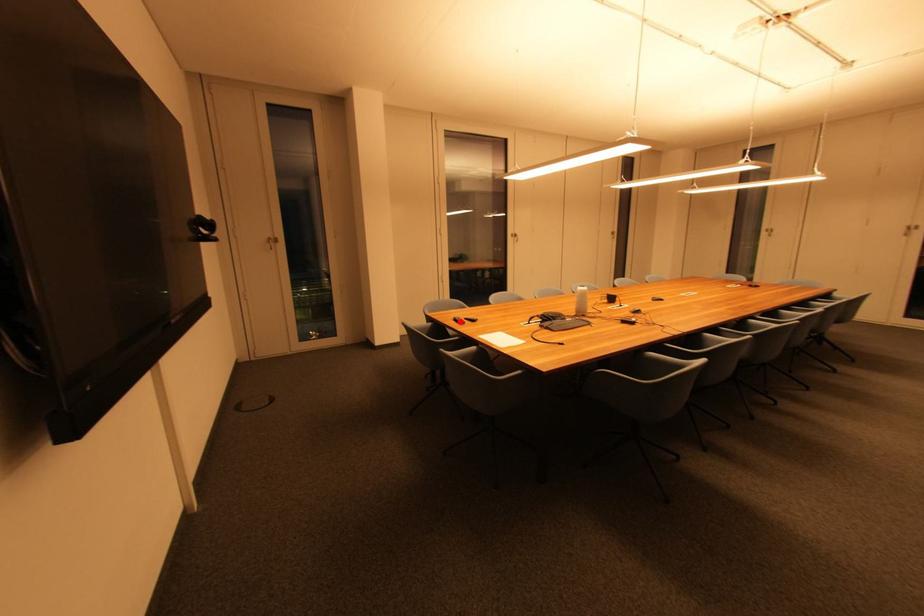
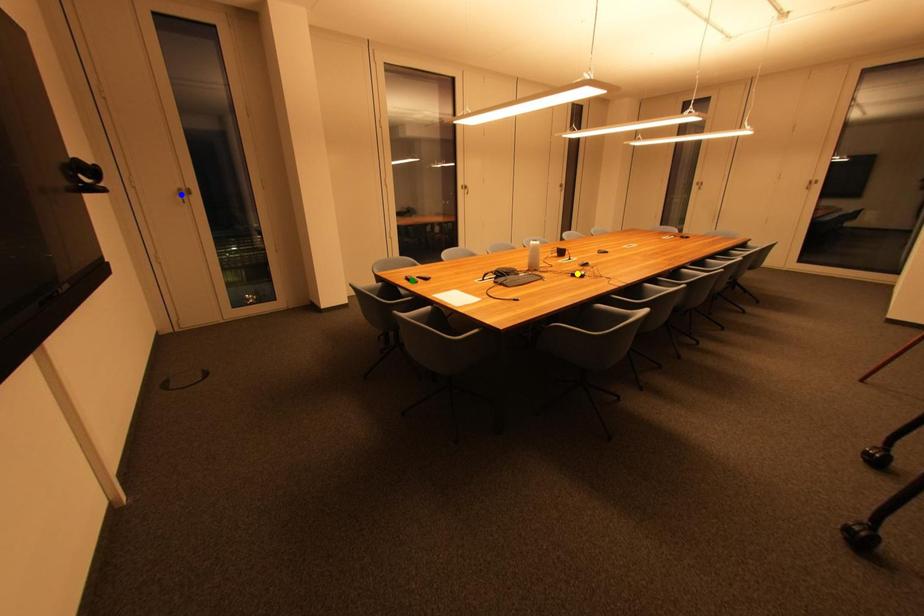
Question: I am providing you with two images of the same scene from different viewpoints. A red point is marked on the first image. You are given multiple points on the second image. In image 2, which mark is for the same physical point as the one in image 1?

Choices:
 (A) yellow point
 (B) green point
 (C) blue point

Answer: (B)